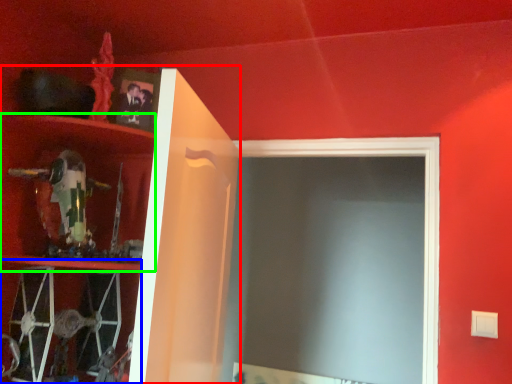
Question: Which object is the closest to the cabinet (highlighted by a red box)? Choose among these: cabinet (highlighted by a blue box) or cabinet (highlighted by a green box).

Choices:
 (A) cabinet
 (B) cabinet

Answer: (B)